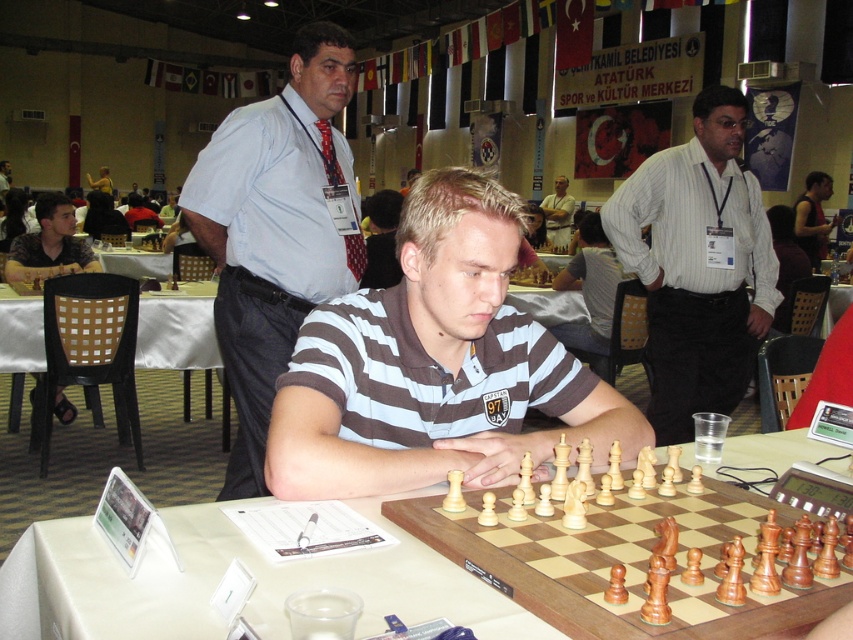
Question: Is brown striped polo shirt at center to the right of white plastic table at center from the viewer's perspective?

Choices:
 (A) no
 (B) yes

Answer: (B)

Question: Which of the following is the closest to the observer?

Choices:
 (A) click(x=764, y=449)
 (B) click(x=422, y=589)

Answer: (B)

Question: Which object is positioned closest to the white wooden table at center?

Choices:
 (A) matte black shirt at left
 (B) matte white shirt at center
 (C) black plastic chair at left
 (D) white plastic table at center

Answer: (C)

Question: Estimate the real-world distances between objects in this image. Which object is closer to the light blue shirt at center?

Choices:
 (A) white striped shirt at center
 (B) matte black shirt at left
 (C) wooden chess set at center

Answer: (C)

Question: Can you confirm if matte black shirt at left is positioned below white plastic table at center?

Choices:
 (A) yes
 (B) no

Answer: (A)

Question: Can you confirm if white wooden table at center is positioned to the right of matte black shirt at left?

Choices:
 (A) yes
 (B) no

Answer: (A)